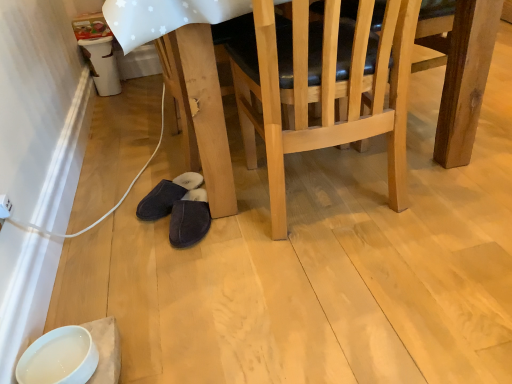
Where is `free space to the left of dark suede slippers at lower center, the first footwear when ordered from right to left`? The image size is (512, 384). free space to the left of dark suede slippers at lower center, the first footwear when ordered from right to left is located at coordinates (132, 245).